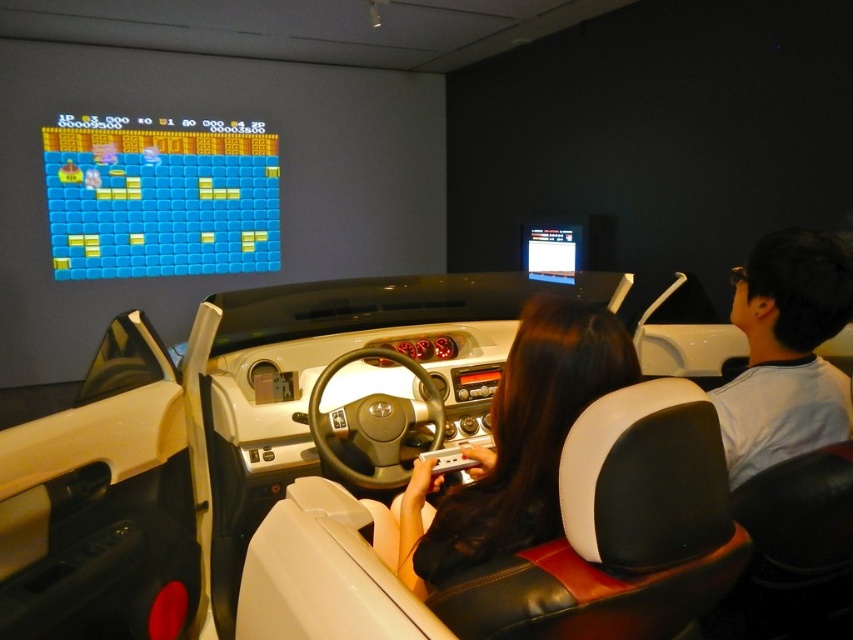
Is white leather car at center behind black leather hair at center?

Yes, it is behind black leather hair at center.

Who is shorter, white leather car at center or black leather hair at center?

black leather hair at center

Locate an element on the screen. Image resolution: width=853 pixels, height=640 pixels. white leather car at center is located at coordinates (218, 442).

I want to click on white leather car at center, so click(x=218, y=442).

Is white leather car at center above gray cotton shirt at right?

No.

Can you confirm if white leather car at center is bigger than gray cotton shirt at right?

Indeed, white leather car at center has a larger size compared to gray cotton shirt at right.

Locate an element on the screen. white leather car at center is located at coordinates (218, 442).

The height and width of the screenshot is (640, 853). I want to click on white leather car at center, so click(218, 442).

Does point (738, 422) come behind point (726, 406)?

No.

Does point (798, 416) lie behind point (843, 289)?

No, it is not.

Locate an element on the screen. black leather car seat at center is located at coordinates (786, 352).